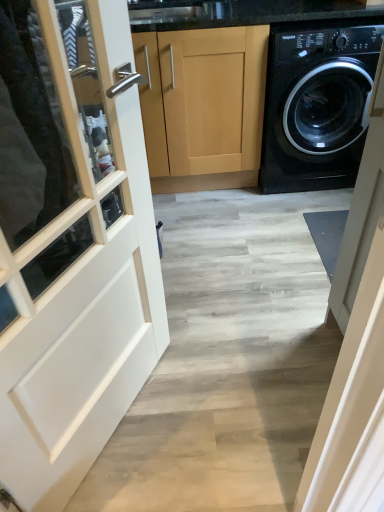
Where is `light wood cabinet at center`? light wood cabinet at center is located at coordinates (203, 106).

The height and width of the screenshot is (512, 384). What do you see at coordinates (203, 106) in the screenshot?
I see `light wood cabinet at center` at bounding box center [203, 106].

Locate an element on the screen. This screenshot has height=512, width=384. black glossy washing machine at right is located at coordinates (317, 106).

In order to face black glossy washing machine at right, should I rotate leftwards or rightwards?

Rotate your view right by about 16.602°.

This screenshot has width=384, height=512. What do you see at coordinates (317, 106) in the screenshot?
I see `black glossy washing machine at right` at bounding box center [317, 106].

Identify the location of light wood cabinet at center. (203, 106).

In the scene shown: Would you say light wood cabinet at center is to the left or to the right of black glossy washing machine at right in the picture?

light wood cabinet at center is positioned on black glossy washing machine at right's left side.

Considering their positions, is light wood cabinet at center located in front of or behind black glossy washing machine at right?

In the image, light wood cabinet at center appears behind black glossy washing machine at right.

Which is in front, point (224, 38) or point (350, 110)?

Point (224, 38)

From the image's perspective, is light wood cabinet at center located above black glossy washing machine at right?

No, from the image's perspective, light wood cabinet at center is not above black glossy washing machine at right.

From a real-world perspective, is light wood cabinet at center on black glossy washing machine at right?

No, from a real-world perspective, light wood cabinet at center is not above black glossy washing machine at right.

From the picture: Considering the sizes of light wood cabinet at center and black glossy washing machine at right in the image, is light wood cabinet at center wider or thinner than black glossy washing machine at right?

Considering their sizes, light wood cabinet at center looks slimmer than black glossy washing machine at right.

Which of these two, light wood cabinet at center or black glossy washing machine at right, stands shorter?

Standing shorter between the two is black glossy washing machine at right.

Considering the relative sizes of light wood cabinet at center and black glossy washing machine at right in the image provided, is light wood cabinet at center smaller than black glossy washing machine at right?

No, light wood cabinet at center is not smaller than black glossy washing machine at right.

Is light wood cabinet at center not inside black glossy washing machine at right?

Yes, light wood cabinet at center is located beyond the bounds of black glossy washing machine at right.

Is light wood cabinet at center next to black glossy washing machine at right?

There is a gap between light wood cabinet at center and black glossy washing machine at right.

Is light wood cabinet at center aimed at black glossy washing machine at right?

No, light wood cabinet at center is not oriented towards black glossy washing machine at right.

Locate an element on the screen. This screenshot has height=512, width=384. washing machine lying in front of the light wood cabinet at center is located at coordinates (317, 106).

Between black glossy washing machine at right and light wood cabinet at center, which one appears on the right side from the viewer's perspective?

Positioned to the right is black glossy washing machine at right.

Between black glossy washing machine at right and light wood cabinet at center, which one is positioned behind?

light wood cabinet at center is behind.

Which is nearer, (x=379, y=26) or (x=239, y=157)?

Point (x=379, y=26) is positioned closer to the camera compared to point (x=239, y=157).

From the image's perspective, is black glossy washing machine at right under light wood cabinet at center?

No.

From a real-world perspective, which is physically above, black glossy washing machine at right or light wood cabinet at center?

In real-world perspective, black glossy washing machine at right is above.

Which object is thinner, black glossy washing machine at right or light wood cabinet at center?

Thinner between the two is light wood cabinet at center.

Which of these two, black glossy washing machine at right or light wood cabinet at center, stands taller?

light wood cabinet at center is taller.

Considering the sizes of objects black glossy washing machine at right and light wood cabinet at center in the image provided, who is smaller, black glossy washing machine at right or light wood cabinet at center?

black glossy washing machine at right is smaller.

Is black glossy washing machine at right not within light wood cabinet at center?

Yes, black glossy washing machine at right is located beyond the bounds of light wood cabinet at center.

Are black glossy washing machine at right and light wood cabinet at center located far from each other?

They are positioned close to each other.

Does black glossy washing machine at right turn towards light wood cabinet at center?

No, black glossy washing machine at right is not oriented towards light wood cabinet at center.

How many degrees apart are the facing directions of black glossy washing machine at right and light wood cabinet at center?

The angle between the facing direction of black glossy washing machine at right and the facing direction of light wood cabinet at center is 0.214 degrees.

Find the location of a particular element. The height and width of the screenshot is (512, 384). cabinetry on the left of black glossy washing machine at right is located at coordinates point(203,106).

There is a light wood cabinet at center. Where is `washing machine above it (from a real-world perspective)`? washing machine above it (from a real-world perspective) is located at coordinates (317, 106).

I want to click on cabinetry below the black glossy washing machine at right (from the image's perspective), so click(203, 106).